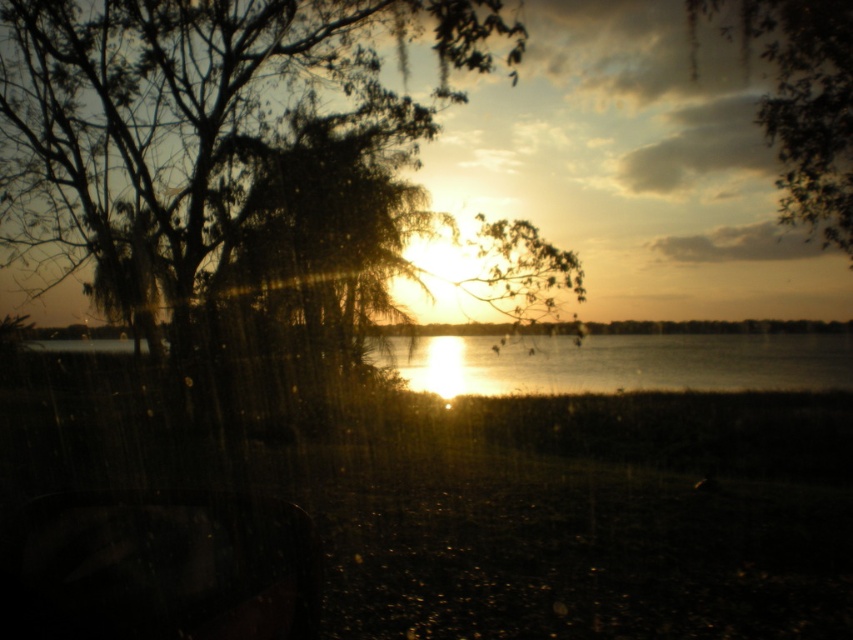
Does point (318, 156) lie behind point (543, 337)?

No, it is not.

Is the position of green leafy tree at center more distant than that of glistening silver water at center?

That is False.

Does point (115, 157) come in front of point (699, 342)?

Yes, it is in front of point (699, 342).

Where is `green leafy tree at center`? This screenshot has width=853, height=640. green leafy tree at center is located at coordinates (223, 148).

Between green leafy tree at center and green leafy tree at upper center, which one is positioned higher?

green leafy tree at upper center is higher up.

Can you confirm if green leafy tree at center is thinner than green leafy tree at upper center?

No.

Is point (386, 248) closer to viewer compared to point (837, 8)?

No, (386, 248) is behind (837, 8).

Locate an element on the screen. This screenshot has width=853, height=640. green leafy tree at center is located at coordinates (223, 148).

Does point (699, 349) come closer to viewer compared to point (791, 176)?

That is False.

Who is more distant from viewer, [579,368] or [799,76]?

Point [579,368]

The width and height of the screenshot is (853, 640). What are the coordinates of `glistening silver water at center` in the screenshot? It's located at (616, 362).